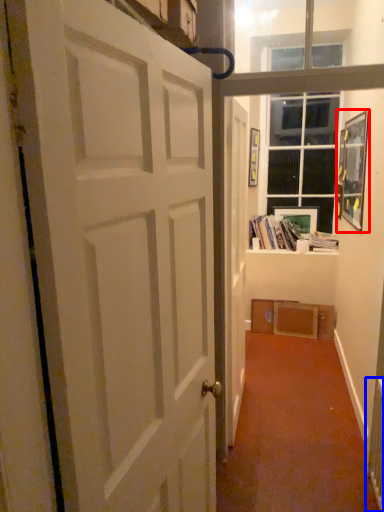
Question: Which of the following is the farthest to the observer, picture frame (highlighted by a red box) or radiator (highlighted by a blue box)?

Choices:
 (A) picture frame
 (B) radiator

Answer: (A)